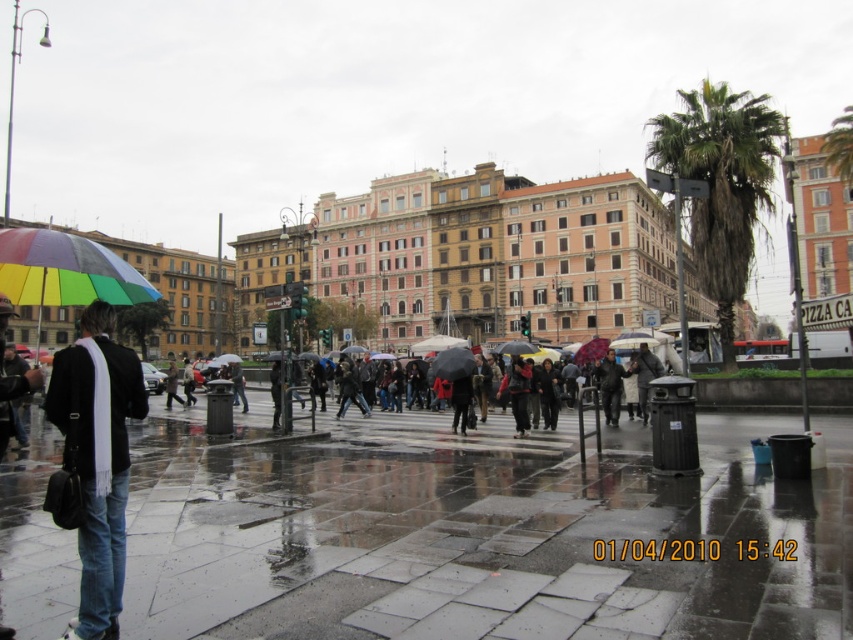
Does rainbow fabric umbrella at left have a greater height compared to brown leather coat at center?

Indeed, rainbow fabric umbrella at left has a greater height compared to brown leather coat at center.

What do you see at coordinates (97, 458) in the screenshot?
I see `rainbow fabric umbrella at left` at bounding box center [97, 458].

Locate an element on the screen. rainbow fabric umbrella at left is located at coordinates (97, 458).

Does shiny concrete pavement at center come in front of rainbow fabric umbrella at center?

Yes, shiny concrete pavement at center is in front of rainbow fabric umbrella at center.

This screenshot has height=640, width=853. Describe the element at coordinates (480, 538) in the screenshot. I see `shiny concrete pavement at center` at that location.

The image size is (853, 640). In order to click on shiny concrete pavement at center in this screenshot , I will do `click(480, 538)`.

Can you confirm if green leafy palm tree at right is bigger than rainbow fabric umbrella at center?

Indeed, green leafy palm tree at right has a larger size compared to rainbow fabric umbrella at center.

Does point (679, 144) lie in front of point (454, 348)?

Yes, it is in front of point (454, 348).

Is point (752, 157) positioned after point (428, 371)?

No, (752, 157) is closer to viewer.

The image size is (853, 640). Find the location of `green leafy palm tree at right`. green leafy palm tree at right is located at coordinates (721, 182).